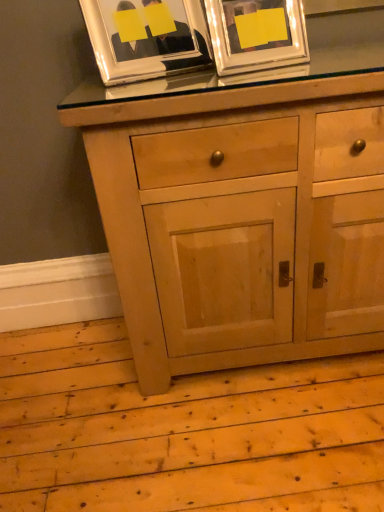
Question: Is metallic silver picture frame at upper center, the first picture frame from the right, wider than natural wood cabinet at center?

Choices:
 (A) no
 (B) yes

Answer: (A)

Question: Can you confirm if metallic silver picture frame at upper center, the first picture frame from the right, is thinner than natural wood cabinet at center?

Choices:
 (A) yes
 (B) no

Answer: (A)

Question: Is natural wood cabinet at center completely or partially inside metallic silver picture frame at upper center, the first picture frame from the right?

Choices:
 (A) yes
 (B) no

Answer: (B)

Question: Is the position of metallic silver picture frame at upper center, the second picture frame viewed from the left, less distant than that of natural wood cabinet at center?

Choices:
 (A) no
 (B) yes

Answer: (A)

Question: From the image's perspective, is metallic silver picture frame at upper center, the first picture frame from the right, beneath natural wood cabinet at center?

Choices:
 (A) no
 (B) yes

Answer: (A)

Question: Can you see metallic silver picture frame at upper center, the second picture frame viewed from the left, touching natural wood cabinet at center?

Choices:
 (A) yes
 (B) no

Answer: (B)

Question: Is natural wood cabinet at center positioned before metallic silver picture frame at upper center, the second picture frame viewed from the left?

Choices:
 (A) yes
 (B) no

Answer: (A)

Question: Is natural wood cabinet at center wider than metallic silver picture frame at upper center, the first picture frame from the right?

Choices:
 (A) no
 (B) yes

Answer: (B)

Question: From the image's perspective, is natural wood cabinet at center on top of metallic silver picture frame at upper center, the second picture frame viewed from the left?

Choices:
 (A) no
 (B) yes

Answer: (A)

Question: Is natural wood cabinet at center at the left side of metallic silver picture frame at upper center, the second picture frame viewed from the left?

Choices:
 (A) yes
 (B) no

Answer: (B)

Question: Is there a large distance between natural wood cabinet at center and metallic silver picture frame at upper center, the first picture frame from the right?

Choices:
 (A) no
 (B) yes

Answer: (A)

Question: Does natural wood cabinet at center have a greater height compared to metallic silver picture frame at upper center, the second picture frame viewed from the left?

Choices:
 (A) yes
 (B) no

Answer: (A)

Question: Can you confirm if natural wood cabinet at center is positioned to the left of silver metallic picture frame at upper left, the 1th picture frame viewed from the left?

Choices:
 (A) no
 (B) yes

Answer: (A)